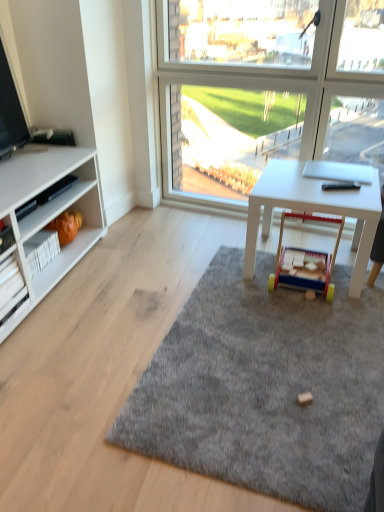
Question: Is white cardboard shelf at left wider than gray soft rug at center?

Choices:
 (A) yes
 (B) no

Answer: (B)

Question: Could you tell me if white cardboard shelf at left is turned towards gray soft rug at center?

Choices:
 (A) no
 (B) yes

Answer: (B)

Question: Does white cardboard shelf at left appear on the left side of gray soft rug at center?

Choices:
 (A) yes
 (B) no

Answer: (A)

Question: Is white cardboard shelf at left oriented away from gray soft rug at center?

Choices:
 (A) yes
 (B) no

Answer: (B)

Question: Considering the relative sizes of white cardboard shelf at left and gray soft rug at center in the image provided, is white cardboard shelf at left shorter than gray soft rug at center?

Choices:
 (A) no
 (B) yes

Answer: (A)

Question: Is gray soft rug at center spatially inside white cardboard shelf at left, or outside of it?

Choices:
 (A) inside
 (B) outside

Answer: (B)

Question: Based on their sizes in the image, would you say gray soft rug at center is bigger or smaller than white cardboard shelf at left?

Choices:
 (A) big
 (B) small

Answer: (A)

Question: In the image, is gray soft rug at center positioned in front of or behind white cardboard shelf at left?

Choices:
 (A) front
 (B) behind

Answer: (A)

Question: From the image's perspective, is gray soft rug at center above or below white cardboard shelf at left?

Choices:
 (A) below
 (B) above

Answer: (A)

Question: In terms of size, does white matte desk at center appear bigger or smaller than white cardboard shelf at left?

Choices:
 (A) small
 (B) big

Answer: (B)

Question: From a real-world perspective, is white matte desk at center above or below white cardboard shelf at left?

Choices:
 (A) below
 (B) above

Answer: (B)

Question: In the image, is white matte desk at center on the left side or the right side of white cardboard shelf at left?

Choices:
 (A) right
 (B) left

Answer: (A)

Question: Relative to white cardboard shelf at left, is white matte desk at center in front or behind?

Choices:
 (A) behind
 (B) front

Answer: (A)

Question: In terms of width, does orange fabric toy at lower left, the 1th toy when ordered from left to right, look wider or thinner when compared to white cardboard shelf at left?

Choices:
 (A) thin
 (B) wide

Answer: (A)

Question: Considering the positions of point (69, 214) and point (18, 287), is point (69, 214) closer or farther from the camera than point (18, 287)?

Choices:
 (A) closer
 (B) farther

Answer: (B)